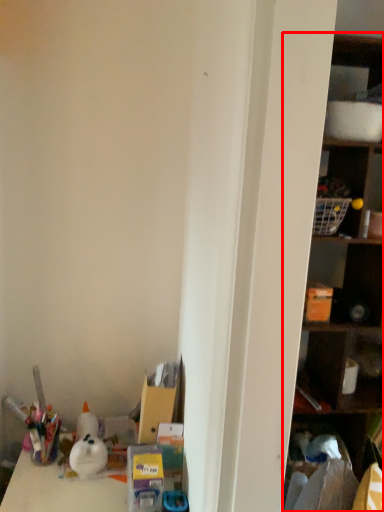
Question: From the image's perspective, where is shelf (annotated by the red box) located relative to cabinet?

Choices:
 (A) above
 (B) below

Answer: (A)